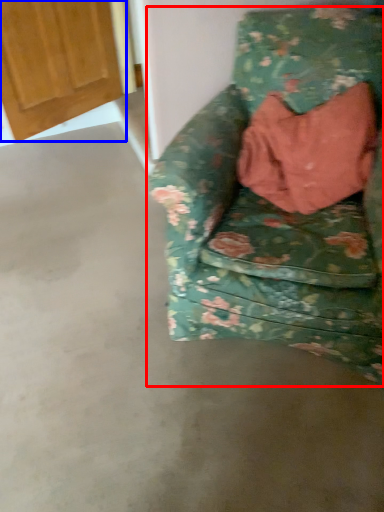
Question: Among these objects, which one is nearest to the camera, chair (highlighted by a red box) or door (highlighted by a blue box)?

Choices:
 (A) chair
 (B) door

Answer: (A)